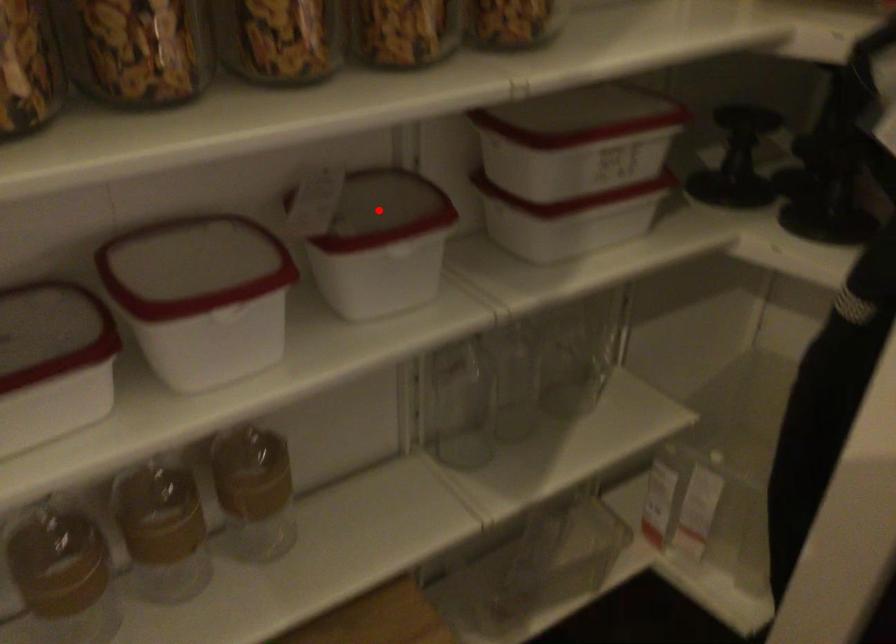
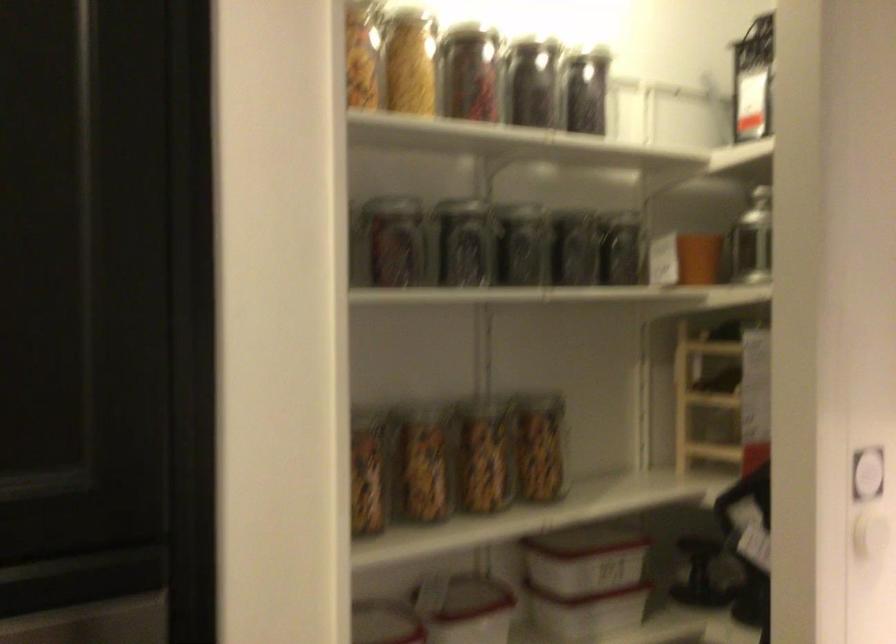
Question: I am providing you with two images of the same scene from different viewpoints. A red point is shown in image1. For the corresponding object point in image2, is it positioned nearer or farther from the camera?

Choices:
 (A) Nearer
 (B) Farther

Answer: (B)